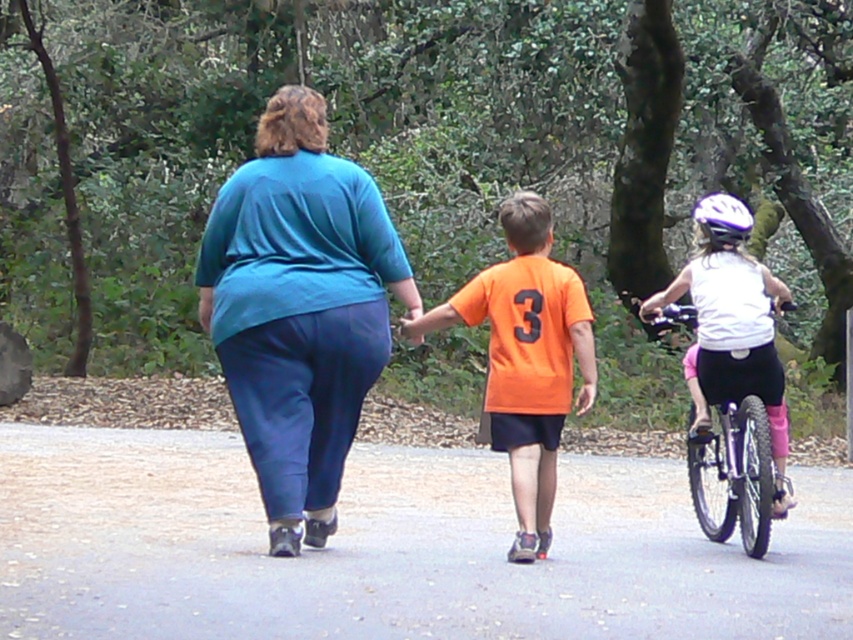
Does gray asphalt road at center have a lesser height compared to white matte bicycle at right?

Yes, gray asphalt road at center is shorter than white matte bicycle at right.

Is gray asphalt road at center thinner than white matte bicycle at right?

Correct, gray asphalt road at center's width is less than white matte bicycle at right's.

Where is `gray asphalt road at center`? gray asphalt road at center is located at coordinates (392, 548).

Can you confirm if white matte bicycle at right is positioned above white matte bicycle helmet at upper center?

No.

Can you confirm if white matte bicycle at right is wider than white matte bicycle helmet at upper center?

Yes.

Is point (718, 440) farther from viewer compared to point (740, 205)?

Yes, point (718, 440) is farther from viewer.

Where is `white matte bicycle at right`? The width and height of the screenshot is (853, 640). white matte bicycle at right is located at coordinates (735, 468).

Locate an element on the screen. The height and width of the screenshot is (640, 853). gray asphalt road at center is located at coordinates pos(392,548).

Which of these two, gray asphalt road at center or teal fabric blouse at center, stands shorter?

With less height is gray asphalt road at center.

Where is `gray asphalt road at center`? Image resolution: width=853 pixels, height=640 pixels. gray asphalt road at center is located at coordinates (392, 548).

You are a GUI agent. You are given a task and a screenshot of the screen. Output one action in this format:
    pyautogui.click(x=<x>, y=<y>)
    Task: Click on the gray asphalt road at center
    
    Given the screenshot: What is the action you would take?
    pyautogui.click(x=392, y=548)